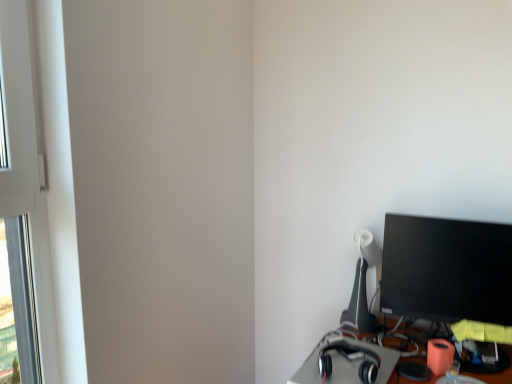
Question: From the image's perspective, is white plastic window frame at left above or below satin black headphones at lower right?

Choices:
 (A) below
 (B) above

Answer: (B)

Question: Do you think white plastic window frame at left is within satin black headphones at lower right, or outside of it?

Choices:
 (A) outside
 (B) inside

Answer: (A)

Question: Considering the real-world distances, which object is farthest from the satin black headphones at lower right?

Choices:
 (A) matte black table lamp at right
 (B) black glossy monitor at right
 (C) white plastic window frame at left

Answer: (C)

Question: Which object is the closest to the matte black table lamp at right?

Choices:
 (A) black glossy monitor at right
 (B) satin black headphones at lower right
 (C) white plastic window frame at left

Answer: (A)